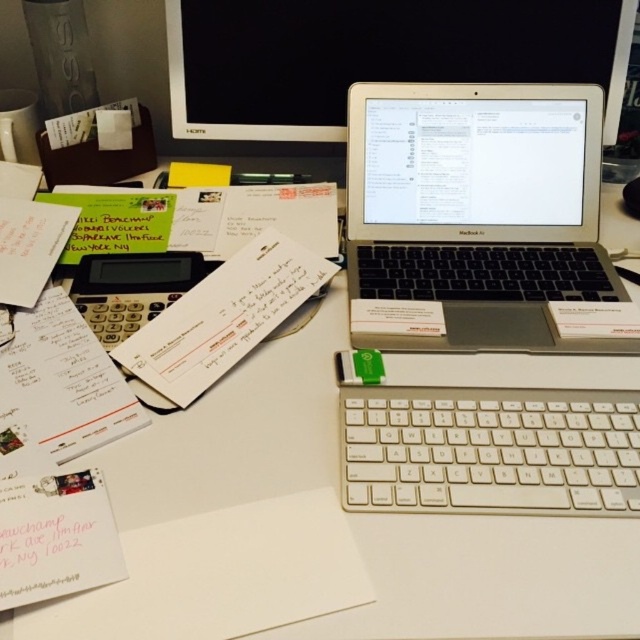
Is white plastic keyboard at center to the right of yellow paper at upper center from the viewer's perspective?

Yes, white plastic keyboard at center is to the right of yellow paper at upper center.

Between point (435, 508) and point (196, 164), which one is positioned in front?

Point (435, 508) is in front.

Image resolution: width=640 pixels, height=640 pixels. Describe the element at coordinates (490, 451) in the screenshot. I see `white plastic keyboard at center` at that location.

Identify the location of white plastic keyboard at center. The height and width of the screenshot is (640, 640). (490, 451).

Is satin black monitor at upper center shorter than white plastic keyboard at center?

No.

Does point (531, 10) lie behind point (506, 508)?

Yes, point (531, 10) is behind point (506, 508).

Image resolution: width=640 pixels, height=640 pixels. Identify the location of satin black monitor at upper center. (374, 56).

Image resolution: width=640 pixels, height=640 pixels. What are the coordinates of `satin black monitor at upper center` in the screenshot? It's located at (374, 56).

Can you confirm if silver metallic laptop at center is positioned above yellow paper at upper center?

No, silver metallic laptop at center is not above yellow paper at upper center.

Can you confirm if silver metallic laptop at center is taller than yellow paper at upper center?

Indeed, silver metallic laptop at center has a greater height compared to yellow paper at upper center.

The height and width of the screenshot is (640, 640). In order to click on silver metallic laptop at center in this screenshot , I will do `click(477, 211)`.